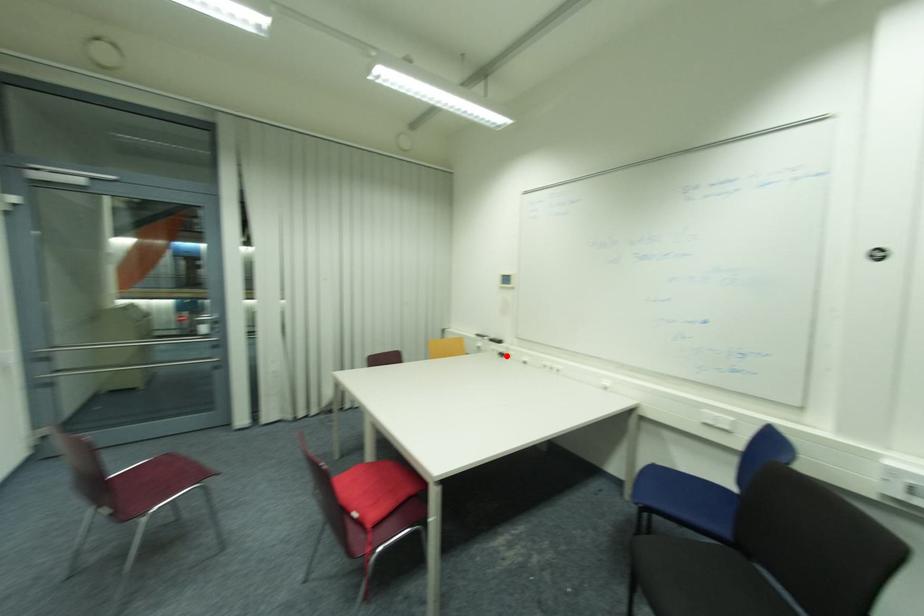
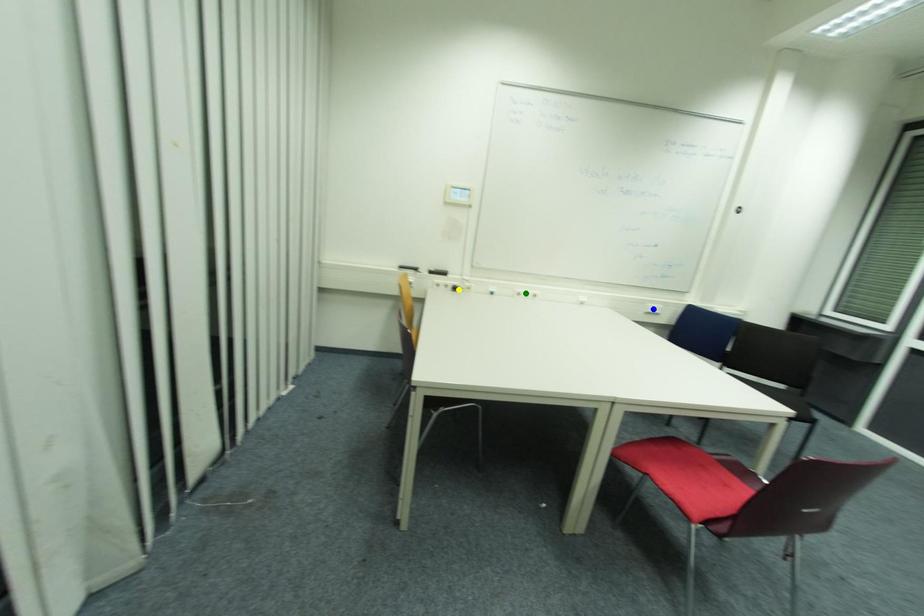
Question: I am providing you with two images of the same scene from different viewpoints. A red point is marked on the first image. You are given multiple points on the second image. Which point in image 2 represents the same 3d spot as the red point in image 1?

Choices:
 (A) yellow point
 (B) blue point
 (C) green point

Answer: (A)